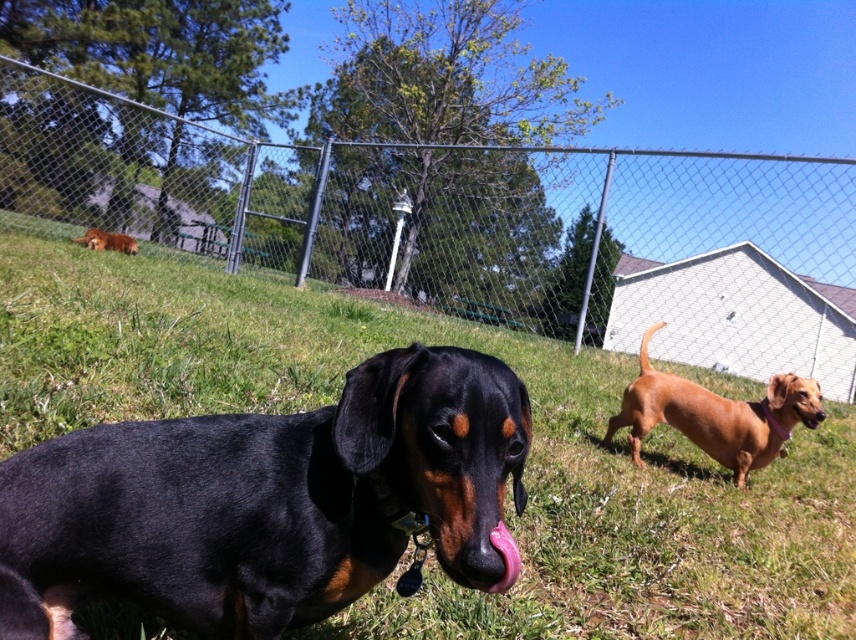
You are standing in the grassy area and see the black and tan dachshund in the foreground and the reddish brown dachshund in the midground. There is a point marked at coordinates (467, 225). What object is located at that point?

The point at coordinates (467, 225) corresponds to the metal chain link fence at center.

You are standing at the origin point in this scene. Which direction should you move to reach the green grass at center?

The green grass at center is located at coordinates point (525, 465), so you should move towards the right and forward to reach it.